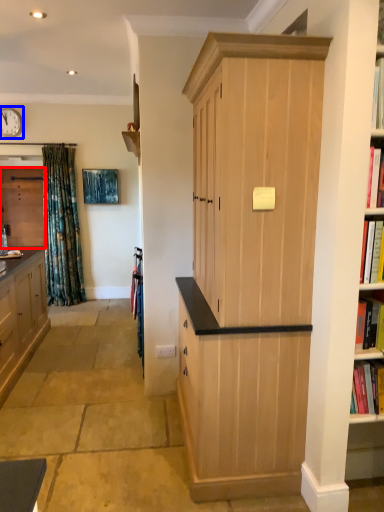
Question: Which object is closer to the camera taking this photo, cabinetry (highlighted by a red box) or clock (highlighted by a blue box)?

Choices:
 (A) cabinetry
 (B) clock

Answer: (B)